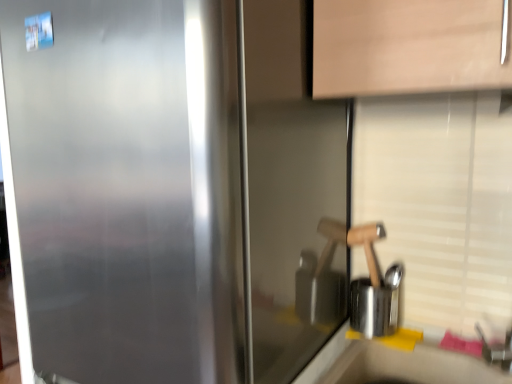
Question: Would you say satin metallic refrigerator at center is inside or outside wooden handle at right?

Choices:
 (A) inside
 (B) outside

Answer: (B)

Question: Considering the positions of satin metallic refrigerator at center and wooden handle at right in the image, is satin metallic refrigerator at center bigger or smaller than wooden handle at right?

Choices:
 (A) small
 (B) big

Answer: (B)

Question: Which object is the farthest from the satin metallic refrigerator at center?

Choices:
 (A) wooden handle at right
 (B) smooth white countertop at lower right

Answer: (B)

Question: Which of these objects is positioned closest to the satin metallic refrigerator at center?

Choices:
 (A) wooden handle at right
 (B) smooth white countertop at lower right

Answer: (A)